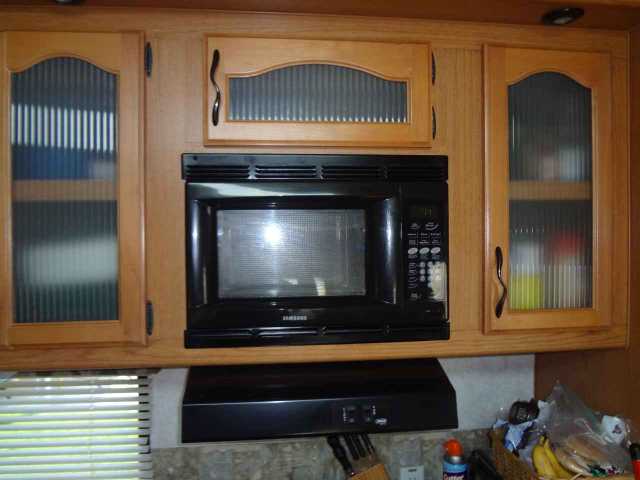
At what (x,y) coordinates should I click in order to perform the action: click on 1 left cabinet. Please return your answer as a coordinate pair (x, y). The width and height of the screenshot is (640, 480). Looking at the image, I should click on (61, 272).